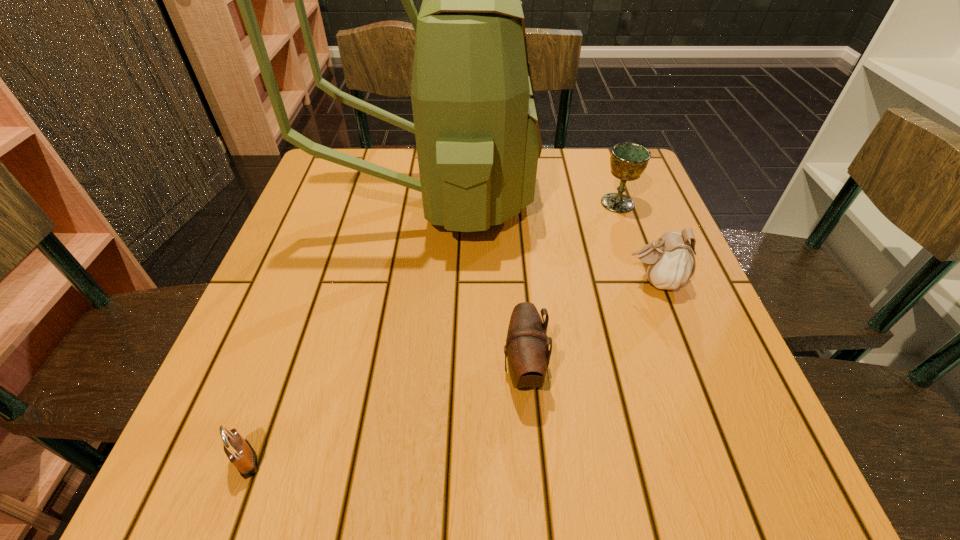
In the image, there is a desktop. At what (x,y) coordinates should I click in order to perform the action: click on free space at the right edge. Please return your answer as a coordinate pair (x, y). The width and height of the screenshot is (960, 540). Looking at the image, I should click on (639, 215).

At what (x,y) coordinates should I click in order to perform the action: click on vacant space at the far left corner of the desktop. Please return your answer as a coordinate pair (x, y). The width and height of the screenshot is (960, 540). Looking at the image, I should click on (344, 167).

The height and width of the screenshot is (540, 960). In the image, there is a desktop. Find the location of `vacant area at the near left corner`. vacant area at the near left corner is located at coordinates (283, 473).

Image resolution: width=960 pixels, height=540 pixels. I want to click on vacant space at the far right corner of the desktop, so click(x=594, y=184).

The height and width of the screenshot is (540, 960). In the image, there is a desktop. What are the coordinates of `vacant space at the near right corner` in the screenshot? It's located at [714, 467].

What are the coordinates of `vacant space that is in between the third farthest object and the chalice` in the screenshot? It's located at (636, 242).

Identify the location of vacant area that lies between the chalice and the farther pouch. (636, 242).

The width and height of the screenshot is (960, 540). What are the coordinates of `vacant space in between the shortest object and the second nearest object` in the screenshot? It's located at (385, 415).

This screenshot has width=960, height=540. I want to click on vacant point located between the tallest object and the third farthest object, so click(542, 240).

This screenshot has width=960, height=540. In order to click on vacant area that lies between the nearer pouch and the padlock in this screenshot , I will do `click(385, 415)`.